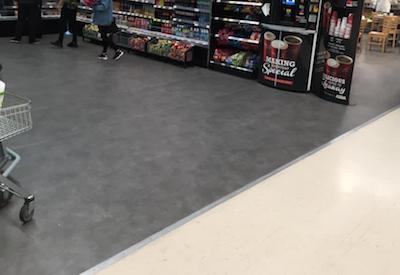
This screenshot has height=275, width=400. I want to click on floor, so click(195, 157).